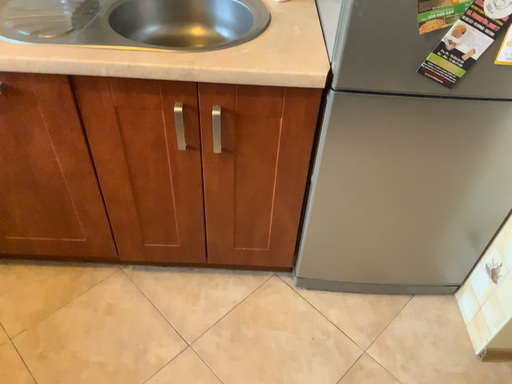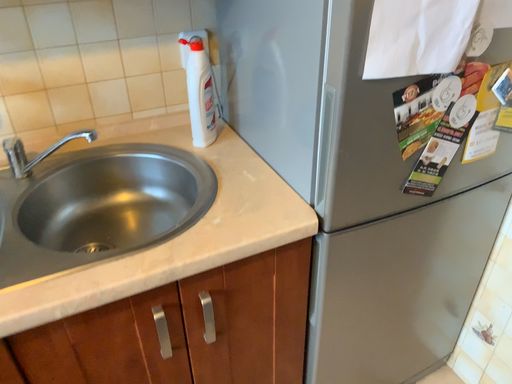
Question: Which way did the camera rotate in the video?

Choices:
 (A) rotated upward
 (B) rotated downward

Answer: (A)